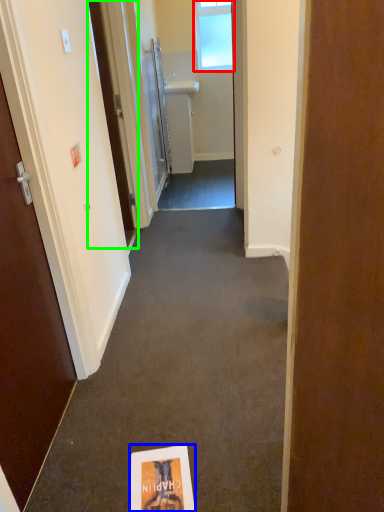
Question: Which is farther away from window (highlighted by a red box)? flyer (highlighted by a blue box) or door (highlighted by a green box)?

Choices:
 (A) flyer
 (B) door

Answer: (A)